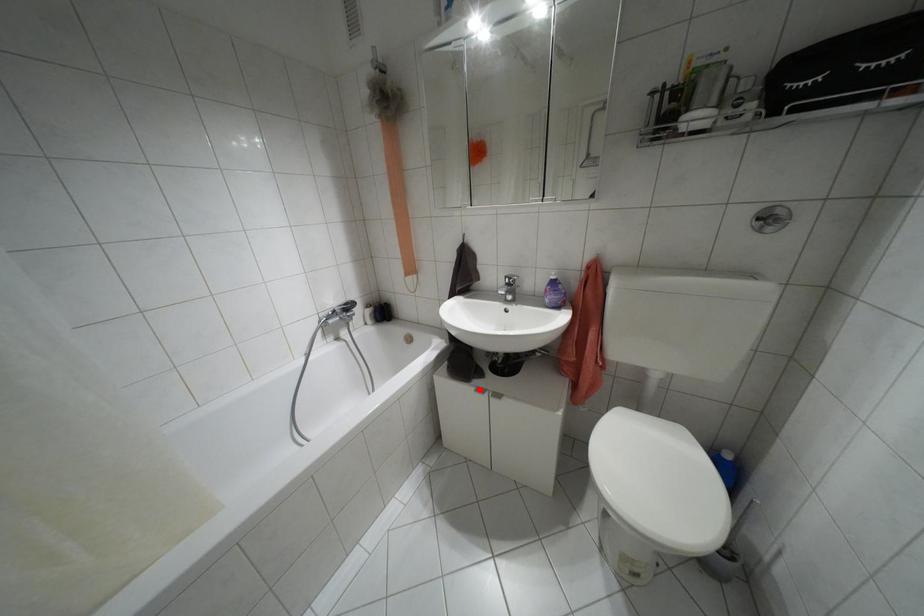
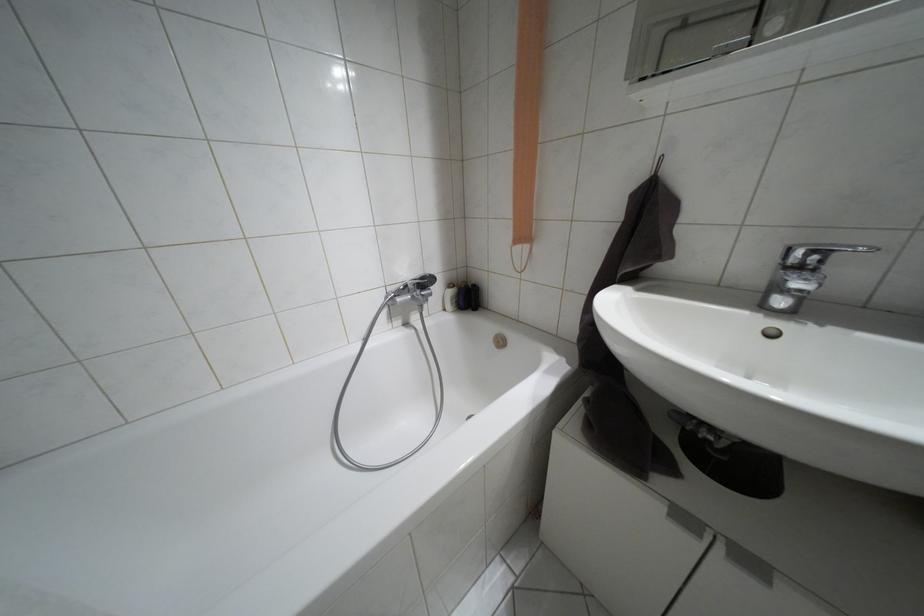
In the second image, find the point that corresponds to the highlighted location in the first image.

(684, 517)